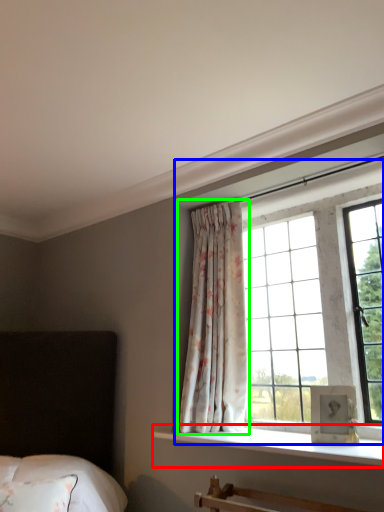
Question: Which object is the closest to the window sill (highlighted by a red box)? Choose among these: bay window (highlighted by a blue box) or curtain (highlighted by a green box).

Choices:
 (A) bay window
 (B) curtain

Answer: (B)